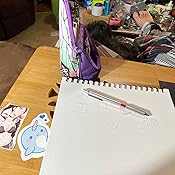
Find the location of a particular element. The image size is (175, 175). pen is located at coordinates (116, 103).